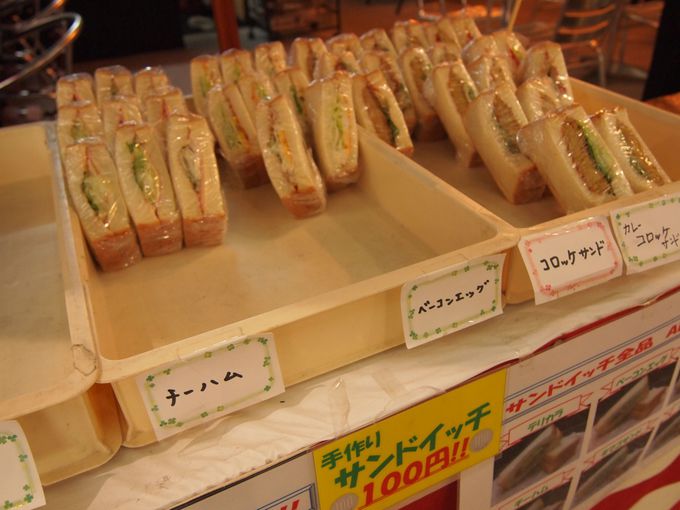
This screenshot has height=510, width=680. I want to click on wooden shelf, so [x=343, y=405].